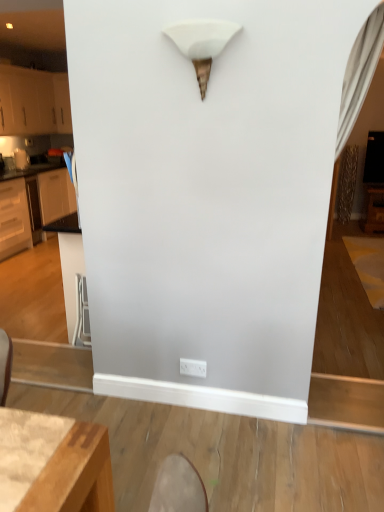
Question: Is the surface of white plastic electric outlet at lower center in direct contact with white matte cone at upper center?

Choices:
 (A) yes
 (B) no

Answer: (B)

Question: Can you confirm if white plastic electric outlet at lower center is wider than white matte cone at upper center?

Choices:
 (A) no
 (B) yes

Answer: (A)

Question: Is the depth of white plastic electric outlet at lower center less than that of white matte cone at upper center?

Choices:
 (A) no
 (B) yes

Answer: (A)

Question: Is white plastic electric outlet at lower center thinner than white matte cone at upper center?

Choices:
 (A) no
 (B) yes

Answer: (B)

Question: Does white plastic electric outlet at lower center have a lesser height compared to white matte cone at upper center?

Choices:
 (A) no
 (B) yes

Answer: (B)

Question: Considering their positions, is white glossy cabinets at left, which appears as the 1th cabinetry when ordered from the bottom, located in front of or behind white plastic electric outlet at lower center?

Choices:
 (A) behind
 (B) front

Answer: (A)

Question: Considering the positions of white glossy cabinets at left, which appears as the second cabinetry when viewed from the top, and white plastic electric outlet at lower center in the image, is white glossy cabinets at left, which appears as the second cabinetry when viewed from the top, taller or shorter than white plastic electric outlet at lower center?

Choices:
 (A) tall
 (B) short

Answer: (A)

Question: Visually, is white glossy cabinets at left, which appears as the second cabinetry when viewed from the top, positioned to the left or to the right of white plastic electric outlet at lower center?

Choices:
 (A) left
 (B) right

Answer: (A)

Question: From the image's perspective, is white glossy cabinets at left, which appears as the second cabinetry when viewed from the top, above or below white plastic electric outlet at lower center?

Choices:
 (A) below
 (B) above

Answer: (B)

Question: Is white glossy cabinets at left, which appears as the 1th cabinetry when ordered from the bottom, inside or outside of brushed metal toaster at left?

Choices:
 (A) inside
 (B) outside

Answer: (B)

Question: Considering the positions of white glossy cabinets at left, which appears as the 1th cabinetry when ordered from the bottom, and brushed metal toaster at left in the image, is white glossy cabinets at left, which appears as the 1th cabinetry when ordered from the bottom, wider or thinner than brushed metal toaster at left?

Choices:
 (A) thin
 (B) wide

Answer: (B)

Question: Is white glossy cabinets at left, which appears as the 1th cabinetry when ordered from the bottom, in front of or behind brushed metal toaster at left in the image?

Choices:
 (A) front
 (B) behind

Answer: (A)

Question: Does point (1, 245) appear closer or farther from the camera than point (18, 153)?

Choices:
 (A) closer
 (B) farther

Answer: (A)

Question: Considering the positions of point (77, 304) and point (198, 368), is point (77, 304) closer or farther from the camera than point (198, 368)?

Choices:
 (A) farther
 (B) closer

Answer: (A)

Question: Considering the positions of metallic silver swivel chair at lower left and white plastic electric outlet at lower center in the image, is metallic silver swivel chair at lower left wider or thinner than white plastic electric outlet at lower center?

Choices:
 (A) wide
 (B) thin

Answer: (A)